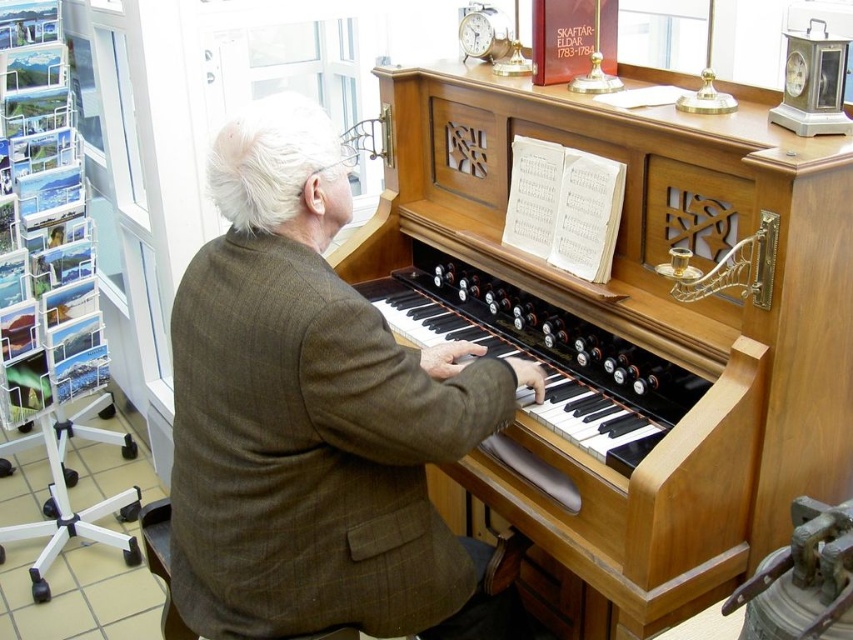
You are a musician who wants to place a 20 inch wide music stand between the wooden piano at center and the brown woolen suit at center. Is there enough space?

The wooden piano at center is 19.40 inches away from brown woolen suit at center, so there is not enough space to place a 20 inch wide music stand between them.